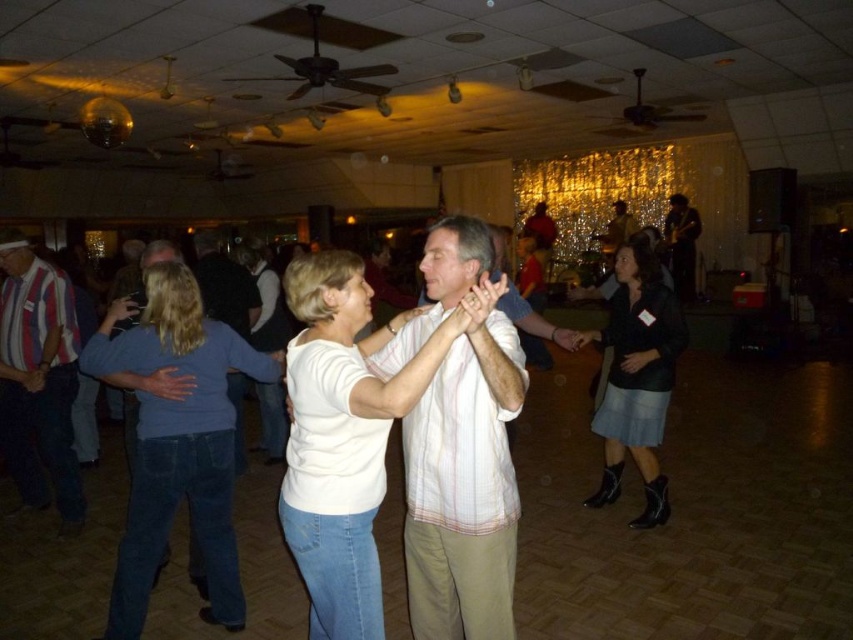
Does denim skirt at lower right come behind dark brown leather jacket at upper right?

No, it is not.

Can you confirm if denim skirt at lower right is positioned below dark brown leather jacket at upper right?

Correct, denim skirt at lower right is located below dark brown leather jacket at upper right.

Who is more distant from viewer, (616,380) or (691,237)?

The point (691,237) is more distant.

Locate an element on the screen. denim skirt at lower right is located at coordinates (636, 378).

Does denim jeans at center appear under striped cotton shirt at left?

Yes.

Is point (193, 342) positioned before point (59, 436)?

Yes, point (193, 342) is in front of point (59, 436).

Is point (155, 285) less distant than point (24, 364)?

That is True.

What are the coordinates of `denim jeans at center` in the screenshot? It's located at (177, 442).

Can you confirm if white matte shirt at center is taller than denim skirt at lower right?

Incorrect, white matte shirt at center's height is not larger of denim skirt at lower right's.

Who is shorter, white matte shirt at center or denim skirt at lower right?

With less height is white matte shirt at center.

The image size is (853, 640). Describe the element at coordinates (346, 435) in the screenshot. I see `white matte shirt at center` at that location.

The height and width of the screenshot is (640, 853). What are the coordinates of `white matte shirt at center` in the screenshot? It's located at (346, 435).